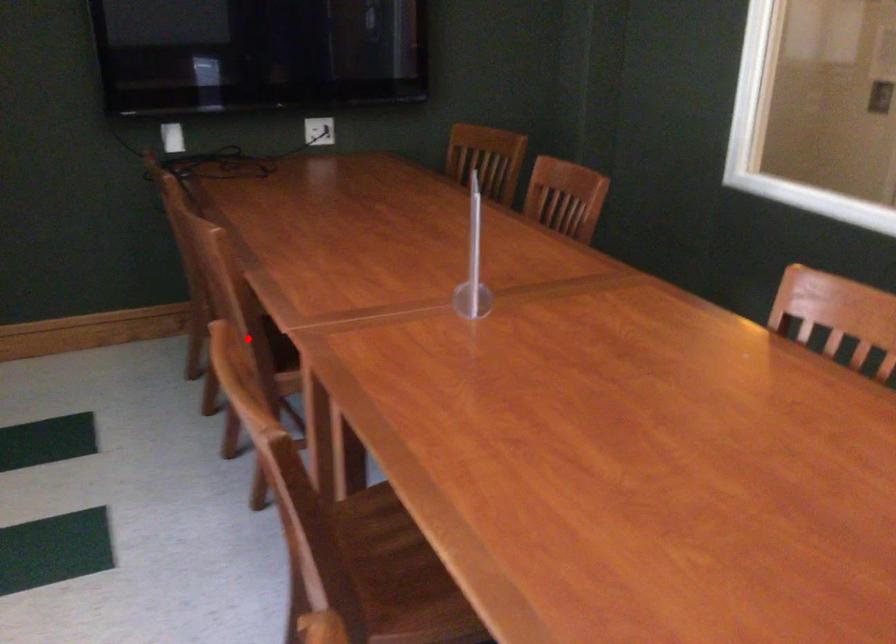
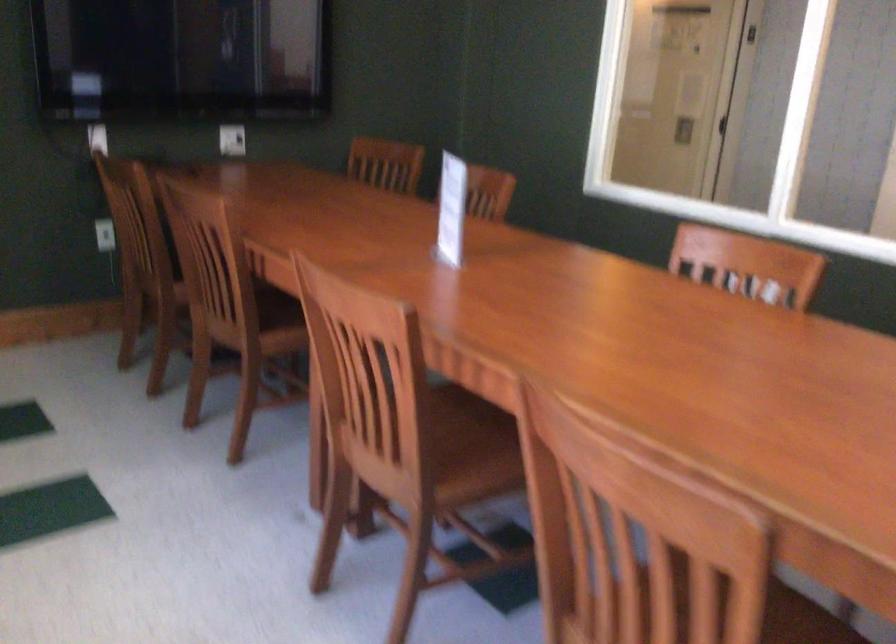
Question: I am providing you with two images of the same scene from different viewpoints. Given a red point in image1, look at the same physical point in image2. Is it:

Choices:
 (A) Closer to the viewpoint
 (B) Farther from the viewpoint

Answer: (B)